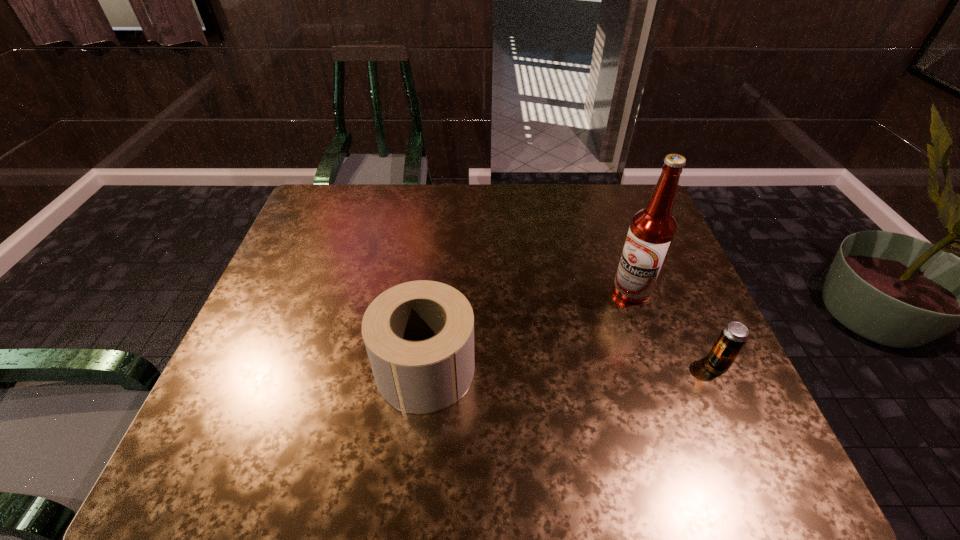
Locate an element on the screen. The height and width of the screenshot is (540, 960). unoccupied position between the toilet tissue and the rightmost object is located at coordinates (571, 366).

Locate an element on the screen. free point between the toilet tissue and the rightmost object is located at coordinates (571, 366).

Where is `free space between the shortest object and the leftmost object`? This screenshot has width=960, height=540. free space between the shortest object and the leftmost object is located at coordinates (571, 366).

At what (x,y) coordinates should I click in order to perform the action: click on object that is the nearest to the leftmost object. Please return your answer as a coordinate pair (x, y). This screenshot has width=960, height=540. Looking at the image, I should click on (652, 230).

Point out which object is positioned as the second nearest to the leftmost object. Please provide its 2D coordinates. Your answer should be formatted as a tuple, i.e. [(x, y)], where the tuple contains the x and y coordinates of a point satisfying the conditions above.

[(733, 337)]

The height and width of the screenshot is (540, 960). I want to click on vacant space that satisfies the following two spatial constraints: 1. on the back side of the shortest object; 2. on the right side of the leftmost object, so click(x=426, y=364).

You are a GUI agent. You are given a task and a screenshot of the screen. Output one action in this format:
    pyautogui.click(x=<x>, y=<y>)
    Task: Click on the free spot that satisfies the following two spatial constraints: 1. on the back side of the tallest object; 2. on the right side of the second shortest object
    The image size is (960, 540).
    Given the screenshot: What is the action you would take?
    pyautogui.click(x=434, y=291)

Locate an element on the screen. free location that satisfies the following two spatial constraints: 1. on the back side of the tallest object; 2. on the left side of the second shortest object is located at coordinates (434, 291).